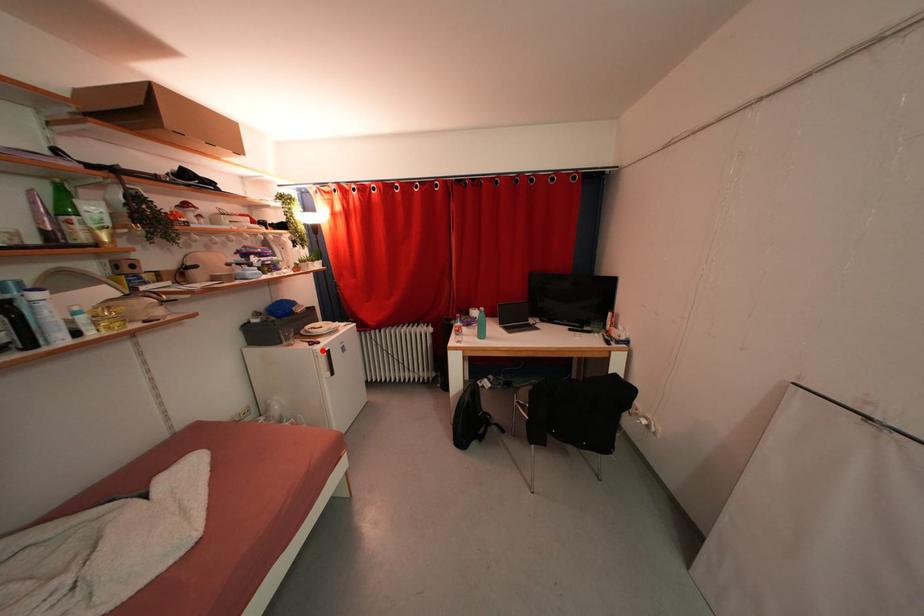
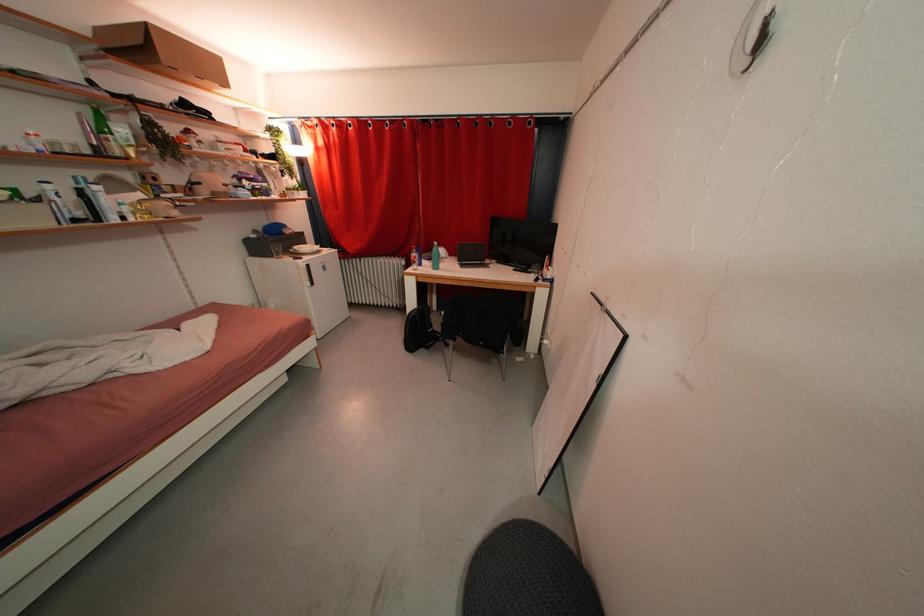
Find the pixel in the second image that matches the highlighted location in the first image.

(305, 265)